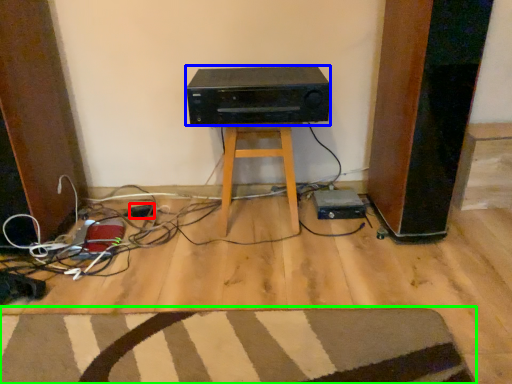
Question: Which object is the closest to the plug (highlighted by a red box)? Choose among these: stereo (highlighted by a blue box) or doormat (highlighted by a green box).

Choices:
 (A) stereo
 (B) doormat

Answer: (A)